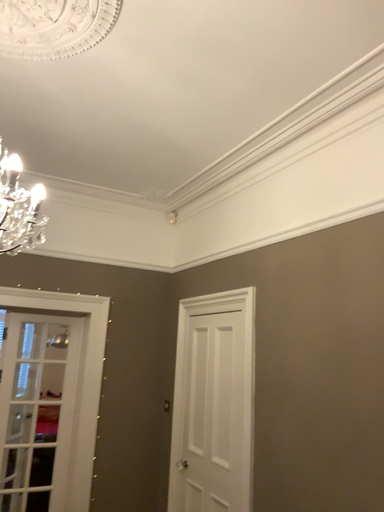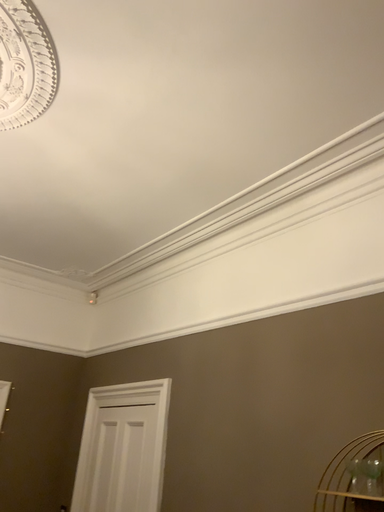
Question: Which way did the camera rotate in the video?

Choices:
 (A) rotated downward
 (B) rotated upward

Answer: (B)